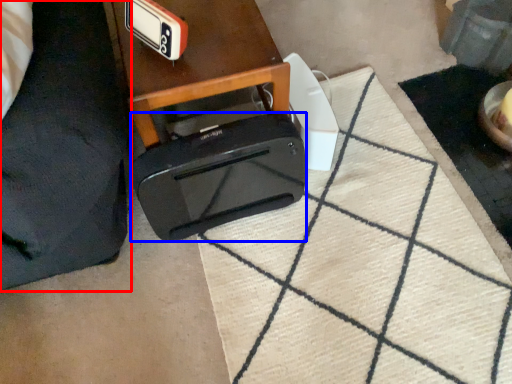
Question: Among these objects, which one is farthest to the camera, furniture (highlighted by a red box) or toaster (highlighted by a blue box)?

Choices:
 (A) furniture
 (B) toaster

Answer: (B)